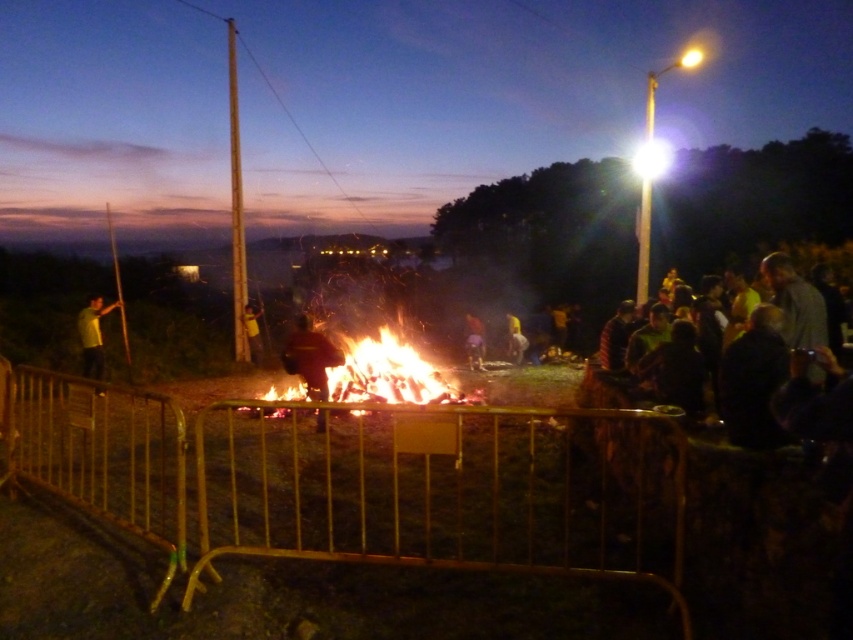
Which of these two, gold metal fence at center or yellow matte shirt at left, stands shorter?

With less height is gold metal fence at center.

Between gold metal fence at center and yellow matte shirt at left, which one is positioned higher?

Positioned higher is yellow matte shirt at left.

Locate an element on the screen. gold metal fence at center is located at coordinates (360, 481).

This screenshot has width=853, height=640. Find the location of `gold metal fence at center`. gold metal fence at center is located at coordinates (360, 481).

What do you see at coordinates (93, 336) in the screenshot? I see `yellow matte shirt at left` at bounding box center [93, 336].

Who is more forward, [96,372] or [466,339]?

Positioned in front is point [96,372].

You are a GUI agent. You are given a task and a screenshot of the screen. Output one action in this format:
    pyautogui.click(x=<x>, y=<y>)
    Task: Click on the yellow matte shirt at left
    
    Given the screenshot: What is the action you would take?
    pyautogui.click(x=93, y=336)

The width and height of the screenshot is (853, 640). Describe the element at coordinates (310, 356) in the screenshot. I see `dark red fabric at center` at that location.

This screenshot has width=853, height=640. Identify the location of dark red fabric at center. (310, 356).